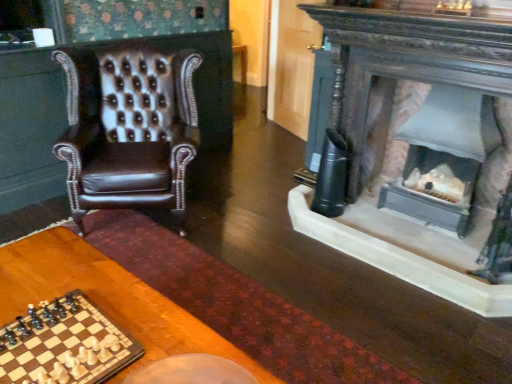
Question: Considering the relative sizes of wooden chessboard at lower left and wooden table at lower left in the image provided, is wooden chessboard at lower left bigger than wooden table at lower left?

Choices:
 (A) yes
 (B) no

Answer: (B)

Question: Considering the relative sizes of wooden chessboard at lower left and wooden table at lower left in the image provided, is wooden chessboard at lower left smaller than wooden table at lower left?

Choices:
 (A) no
 (B) yes

Answer: (B)

Question: Is wooden table at lower left surrounded by wooden chessboard at lower left?

Choices:
 (A) yes
 (B) no

Answer: (B)

Question: Is wooden chessboard at lower left thinner than wooden table at lower left?

Choices:
 (A) no
 (B) yes

Answer: (B)

Question: From the image's perspective, is wooden chessboard at lower left under wooden table at lower left?

Choices:
 (A) yes
 (B) no

Answer: (B)

Question: Considering the positions of wooden chessboard at lower left and wooden table at lower left in the image, is wooden chessboard at lower left taller or shorter than wooden table at lower left?

Choices:
 (A) short
 (B) tall

Answer: (A)

Question: Considering their positions, is wooden chessboard at lower left located in front of or behind wooden table at lower left?

Choices:
 (A) behind
 (B) front

Answer: (A)

Question: Does point (59, 326) appear closer or farther from the camera than point (121, 266)?

Choices:
 (A) closer
 (B) farther

Answer: (A)

Question: From a real-world perspective, is wooden chessboard at lower left physically located above or below wooden table at lower left?

Choices:
 (A) above
 (B) below

Answer: (A)

Question: Is point (120, 122) positioned closer to the camera than point (200, 345)?

Choices:
 (A) farther
 (B) closer

Answer: (A)

Question: In terms of size, does brown leather chair at left appear bigger or smaller than wooden table at lower left?

Choices:
 (A) big
 (B) small

Answer: (A)

Question: From their relative heights in the image, would you say brown leather chair at left is taller or shorter than wooden table at lower left?

Choices:
 (A) short
 (B) tall

Answer: (B)

Question: From the image's perspective, relative to wooden table at lower left, is brown leather chair at left above or below?

Choices:
 (A) below
 (B) above

Answer: (B)

Question: Is point 228,344 closer or farther from the camera than point 46,327?

Choices:
 (A) farther
 (B) closer

Answer: (B)

Question: From the image's perspective, relative to wooden chessboard at lower left, is wooden table at lower left above or below?

Choices:
 (A) below
 (B) above

Answer: (A)